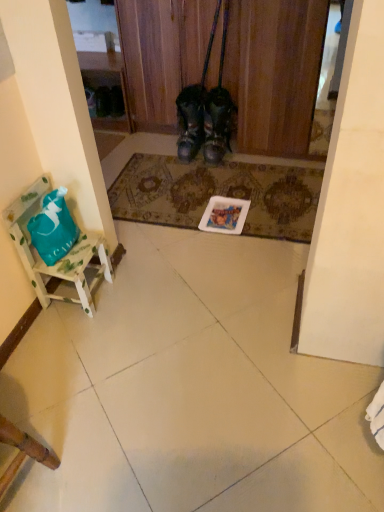
Where is `free space to the right of white wood chair at left`? The width and height of the screenshot is (384, 512). free space to the right of white wood chair at left is located at coordinates 133,293.